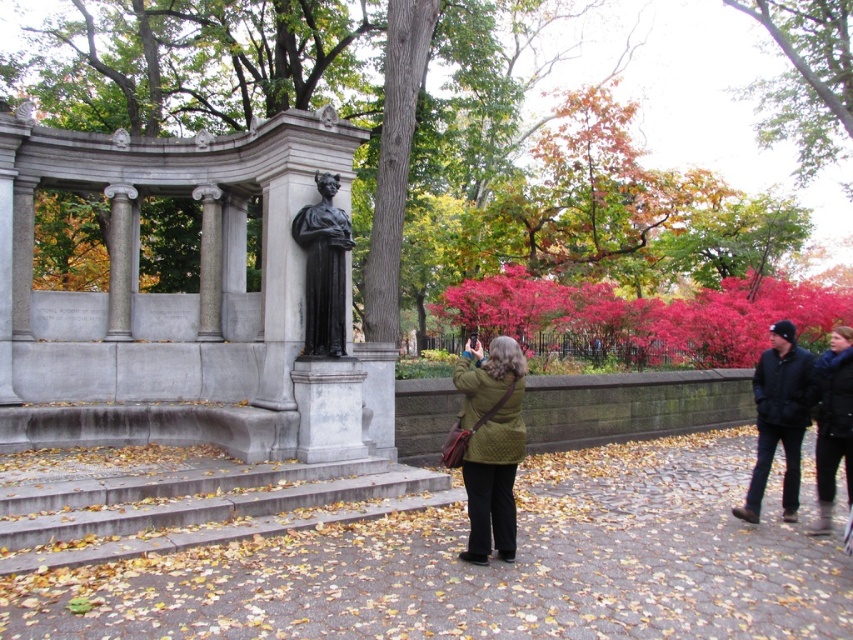
Question: Does green leafy tree at center appear under black polished statue at center?

Choices:
 (A) no
 (B) yes

Answer: (A)

Question: Which of the following is the closest to the observer?

Choices:
 (A) (805, 376)
 (B) (202, 486)
 (C) (468, 371)
 (D) (836, 428)

Answer: (C)

Question: Does green leafy tree at upper center appear under black polished statue at center?

Choices:
 (A) yes
 (B) no

Answer: (B)

Question: Observing the image, what is the correct spatial positioning of gray concrete stairs at lower center in reference to black leather jacket at lower right?

Choices:
 (A) above
 (B) below

Answer: (B)

Question: Which point is closer to the camera?

Choices:
 (A) green leafy tree at center
 (B) green textured coat at center
 (C) green leafy tree at upper center

Answer: (B)

Question: Which of the following is the closest to the observer?

Choices:
 (A) (1, 490)
 (B) (567, 74)

Answer: (A)